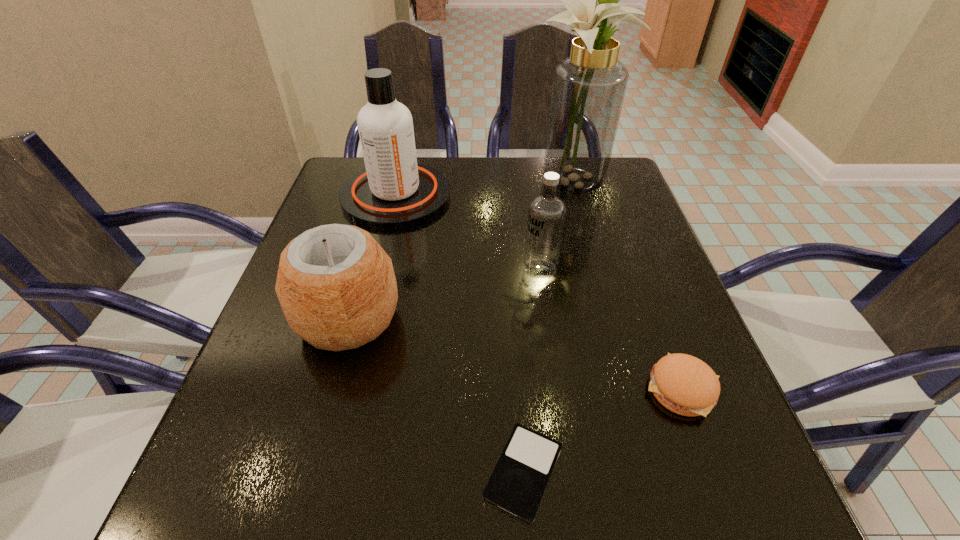
Find the location of a particular element. This screenshot has width=960, height=540. vacant space in between the iPod and the tallest object is located at coordinates (550, 327).

Where is `vacant area between the patty and the cleansing agent`? vacant area between the patty and the cleansing agent is located at coordinates click(539, 292).

Find the location of `vacant area between the fifth tallest object and the cleansing agent`. vacant area between the fifth tallest object and the cleansing agent is located at coordinates 539,292.

Where is `empty space that is in between the flower arrangement and the nearest object`? empty space that is in between the flower arrangement and the nearest object is located at coordinates (550, 327).

The width and height of the screenshot is (960, 540). Find the location of `vacant area that lies between the nearest object and the coconut`. vacant area that lies between the nearest object and the coconut is located at coordinates (436, 395).

Where is `empty space between the coconut and the third farthest object`? The width and height of the screenshot is (960, 540). empty space between the coconut and the third farthest object is located at coordinates (444, 294).

In order to click on unoccupied position between the iPod and the third farthest object in this screenshot , I will do `click(532, 371)`.

I want to click on empty space that is in between the coconut and the iPod, so click(x=436, y=395).

Identify which object is the second closest to the second tallest object. Please provide its 2D coordinates. Your answer should be formatted as a tuple, i.e. [(x, y)], where the tuple contains the x and y coordinates of a point satisfying the conditions above.

[(547, 212)]

Where is `object that is the third nearest to the coconut`? object that is the third nearest to the coconut is located at coordinates point(547,212).